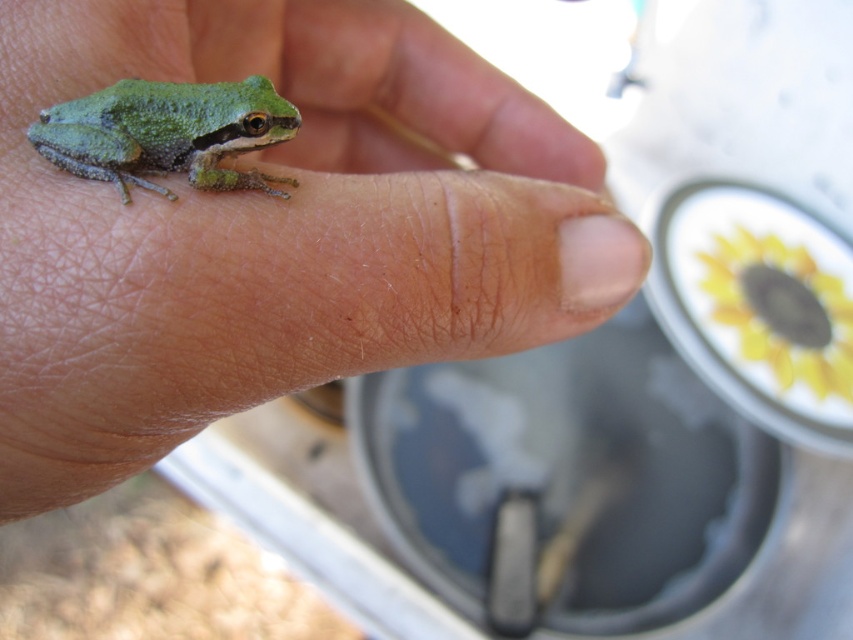
Is green matte skin at center above green matte frog at center?

No, green matte skin at center is not above green matte frog at center.

Consider the image. Who is lower down, green matte skin at center or green matte frog at center?

green matte skin at center is lower down.

Between point (231, 77) and point (200, 108), which one is positioned in front?

Positioned in front is point (200, 108).

This screenshot has height=640, width=853. What are the coordinates of `green matte skin at center` in the screenshot? It's located at (276, 228).